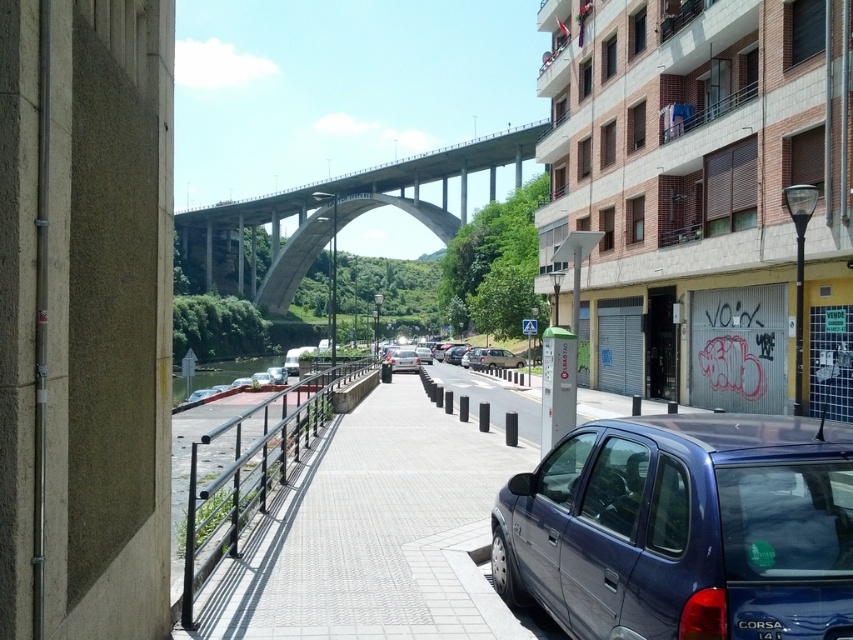
Question: Based on their relative distances, which object is farther from the silver metallic sedan at center?

Choices:
 (A) silver metallic hatchback at center
 (B) metallic blue sedan at lower right
 (C) gray concrete pavement at center

Answer: (B)

Question: Among these points, which one is nearest to the camera?

Choices:
 (A) 561,465
 (B) 469,352
 (C) 496,152

Answer: (A)

Question: Observing the image, what is the correct spatial positioning of black plastic license plate at lower right in reference to silver metallic sedan at center?

Choices:
 (A) below
 (B) above

Answer: (B)

Question: Which point is farther to the camera?

Choices:
 (A) concrete bridge at center
 (B) metallic blue sedan at lower right

Answer: (A)

Question: Is metallic blue sedan at lower right to the right of black plastic license plate at lower right from the viewer's perspective?

Choices:
 (A) yes
 (B) no

Answer: (B)

Question: Can you confirm if concrete bridge at center is positioned to the right of silver metallic sedan at center?

Choices:
 (A) no
 (B) yes

Answer: (B)